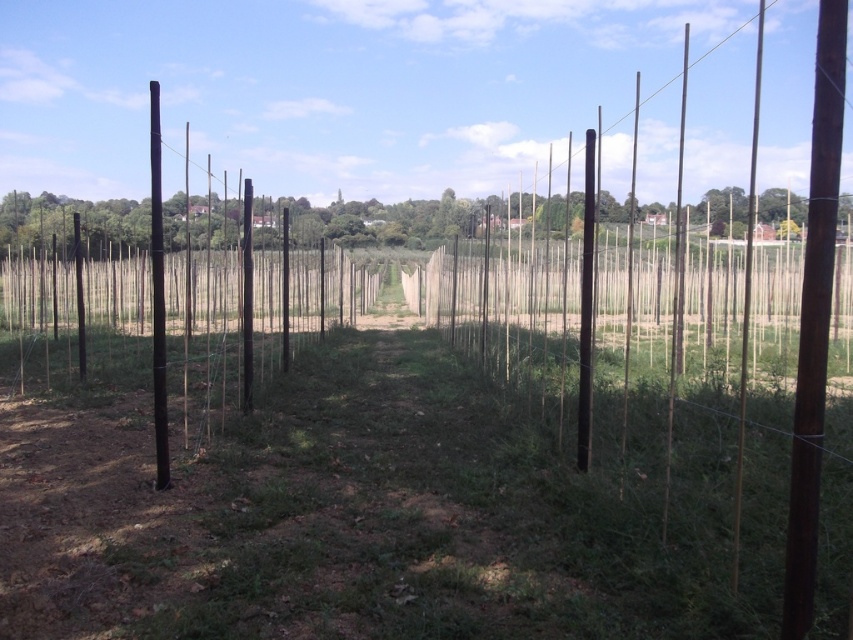
Question: Considering the relative positions of green wood fence at center and black smooth pole at left in the image provided, where is green wood fence at center located with respect to black smooth pole at left?

Choices:
 (A) below
 (B) above

Answer: (A)

Question: Which point appears closest to the camera in this image?

Choices:
 (A) (91, 218)
 (B) (161, 266)

Answer: (B)

Question: Which point appears farthest from the camera in this image?

Choices:
 (A) (341, 227)
 (B) (155, 403)

Answer: (A)

Question: Which point is closer to the camera taking this photo?

Choices:
 (A) (160, 131)
 (B) (33, 205)

Answer: (B)

Question: Observing the image, what is the correct spatial positioning of green wood fence at center in reference to black smooth pole at left?

Choices:
 (A) below
 (B) above

Answer: (A)

Question: Does green wood fence at center have a larger size compared to black smooth pole at left?

Choices:
 (A) no
 (B) yes

Answer: (B)